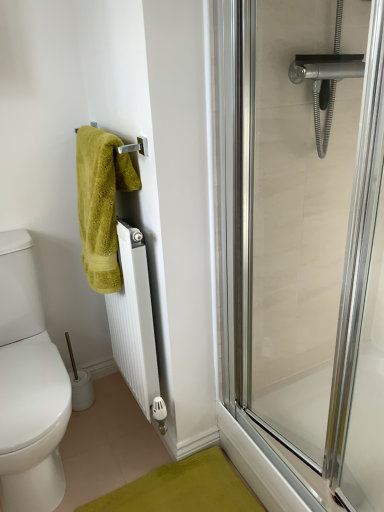
Question: Does white matte radiator at center appear on the right side of clear glass shower door at right?

Choices:
 (A) yes
 (B) no

Answer: (B)

Question: From a real-world perspective, is white matte radiator at center located higher than clear glass shower door at right?

Choices:
 (A) yes
 (B) no

Answer: (B)

Question: Does white matte radiator at center come behind clear glass shower door at right?

Choices:
 (A) yes
 (B) no

Answer: (A)

Question: From the image's perspective, would you say white matte radiator at center is shown under clear glass shower door at right?

Choices:
 (A) yes
 (B) no

Answer: (A)

Question: Is white matte radiator at center bigger than clear glass shower door at right?

Choices:
 (A) yes
 (B) no

Answer: (A)

Question: From their relative heights in the image, would you say white plastic toilet paper at lower left is taller or shorter than clear glass shower door at right?

Choices:
 (A) tall
 (B) short

Answer: (B)

Question: Is point (79, 398) closer or farther from the camera than point (301, 200)?

Choices:
 (A) farther
 (B) closer

Answer: (A)

Question: Relative to clear glass shower door at right, is white plastic toilet paper at lower left in front or behind?

Choices:
 (A) behind
 (B) front

Answer: (A)

Question: Would you say white plastic toilet paper at lower left is inside or outside clear glass shower door at right?

Choices:
 (A) inside
 (B) outside

Answer: (B)

Question: In the image, is white matte radiator at center positioned in front of or behind green fuzzy towel at upper left?

Choices:
 (A) behind
 (B) front

Answer: (A)

Question: Is white matte radiator at center wider or thinner than green fuzzy towel at upper left?

Choices:
 (A) wide
 (B) thin

Answer: (B)

Question: From a real-world perspective, is white matte radiator at center above or below green fuzzy towel at upper left?

Choices:
 (A) above
 (B) below

Answer: (B)

Question: Is white matte radiator at center to the left or to the right of green fuzzy towel at upper left in the image?

Choices:
 (A) left
 (B) right

Answer: (B)

Question: From the image's perspective, is clear glass shower door at right positioned above or below green fuzzy towel at upper left?

Choices:
 (A) above
 (B) below

Answer: (B)

Question: Visually, is clear glass shower door at right positioned to the left or to the right of green fuzzy towel at upper left?

Choices:
 (A) right
 (B) left

Answer: (A)